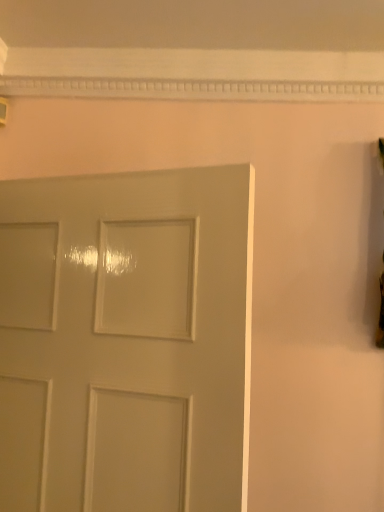
Identify the location of matte white door at center. The height and width of the screenshot is (512, 384). (126, 341).

What do you see at coordinates (126, 341) in the screenshot? I see `matte white door at center` at bounding box center [126, 341].

Image resolution: width=384 pixels, height=512 pixels. In order to click on matte white door at center in this screenshot , I will do `click(126, 341)`.